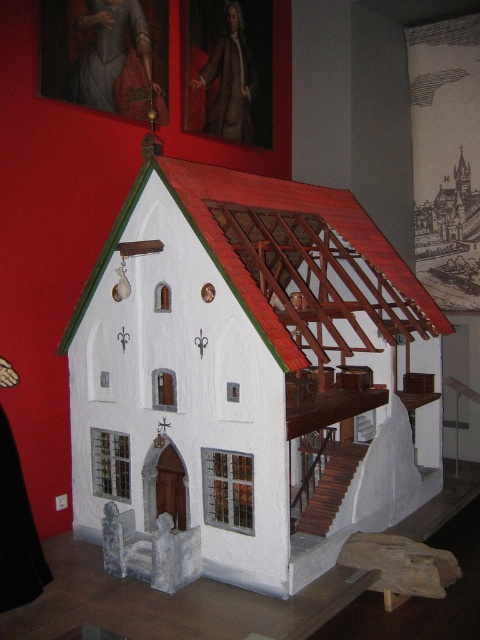
Question: Observing the image, what is the correct spatial positioning of white painted wood chapel at center in reference to brown leather coat at upper center?

Choices:
 (A) left
 (B) right

Answer: (B)

Question: Which of these objects is positioned farthest from the matte red cloth at upper left?

Choices:
 (A) brown leather coat at upper center
 (B) white painted wood chapel at center

Answer: (B)

Question: Does white painted wood chapel at center appear on the right side of brown leather coat at upper center?

Choices:
 (A) no
 (B) yes

Answer: (B)

Question: Can you confirm if matte red cloth at upper left is wider than brown leather coat at upper center?

Choices:
 (A) yes
 (B) no

Answer: (A)

Question: Which point appears closest to the camera in this image?

Choices:
 (A) (244, 77)
 (B) (113, 42)

Answer: (B)

Question: Based on their relative distances, which object is nearer to the brown leather coat at upper center?

Choices:
 (A) white painted wood chapel at center
 (B) matte red cloth at upper left

Answer: (B)